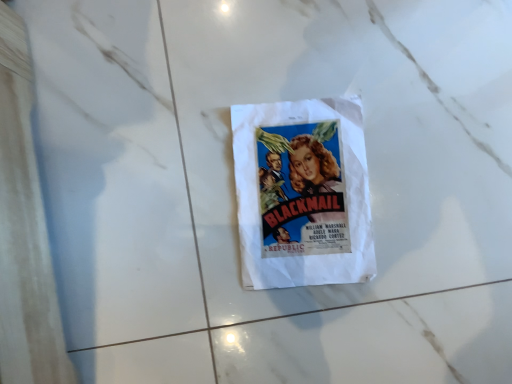
Describe the element at coordinates (302, 193) in the screenshot. I see `matte paper poster at center` at that location.

You are a GUI agent. You are given a task and a screenshot of the screen. Output one action in this format:
    pyautogui.click(x=<x>, y=<y>)
    Task: Click on the matte paper poster at center
    
    Given the screenshot: What is the action you would take?
    pyautogui.click(x=302, y=193)

This screenshot has height=384, width=512. What are the coordinates of `matte paper poster at center` in the screenshot? It's located at (302, 193).